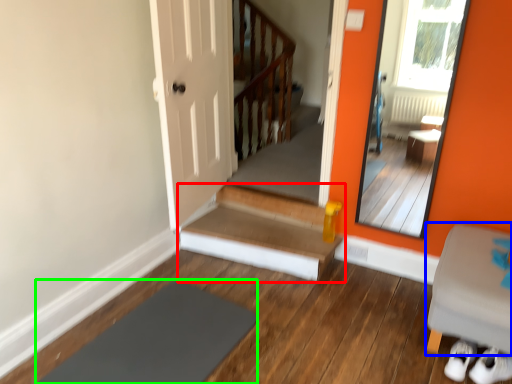
Question: Which is nearer to the stairs (highlighted by a red box)? furniture (highlighted by a blue box) or slate (highlighted by a green box).

Choices:
 (A) furniture
 (B) slate

Answer: (B)